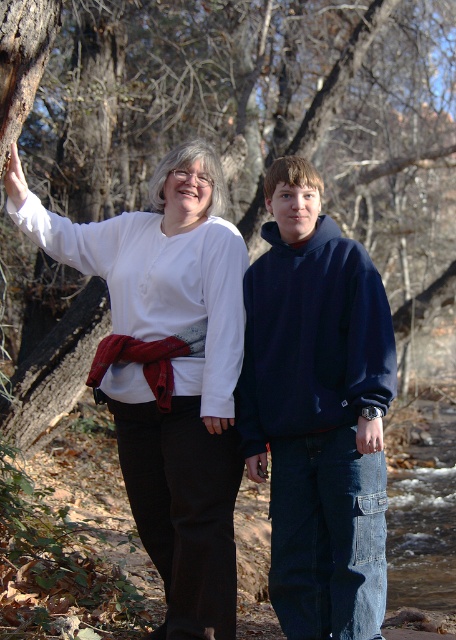
Question: Can you confirm if smooth bark tree trunk at left is thinner than navy blue hoodie at center?

Choices:
 (A) yes
 (B) no

Answer: (B)

Question: Which of the following is the farthest from the observer?

Choices:
 (A) (259, 380)
 (B) (186, 536)
 (C) (450, 161)

Answer: (C)

Question: Estimate the real-world distances between objects in this image. Which object is closer to the smooth bark tree trunk at left?

Choices:
 (A) navy blue hoodie at center
 (B) white matte shirt at upper left

Answer: (B)

Question: Is white matte shirt at upper left to the left of navy blue hoodie at center from the viewer's perspective?

Choices:
 (A) no
 (B) yes

Answer: (B)

Question: Can you confirm if smooth bark tree trunk at left is thinner than white matte shirt at upper left?

Choices:
 (A) no
 (B) yes

Answer: (A)

Question: Which of the following is the closest to the observer?

Choices:
 (A) (382, 120)
 (B) (150, 355)
 (C) (299, 362)

Answer: (C)